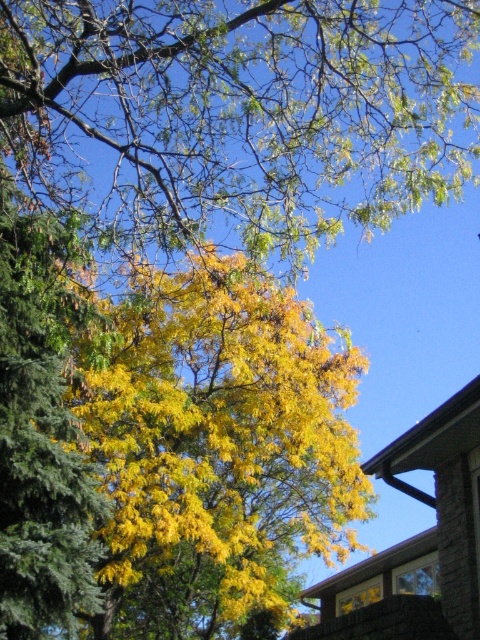
Based on the scene described, where is the green leafy tree at upper center located in terms of coordinates?

The green leafy tree at upper center is located at coordinates point (x=241, y=113).

You are standing at the center of the image and want to locate the yellow leafy tree at center. According to the coordinates, where exactly is it positioned?

The yellow leafy tree at center is positioned at the 2D coordinates point (215, 449).